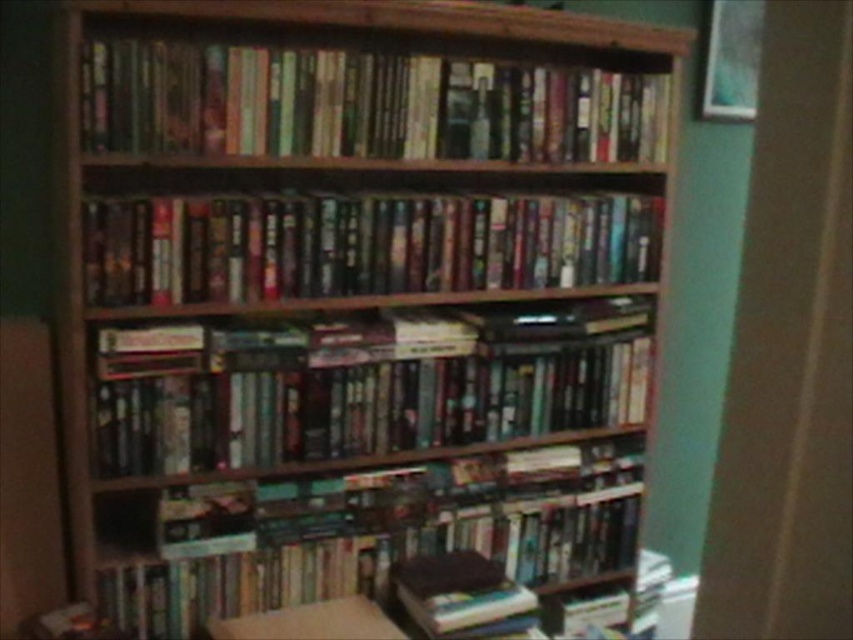
Question: Which object is positioned farthest from the hardcover books at upper center?

Choices:
 (A) hardcover books at center
 (B) shiny plastic books at center

Answer: (A)

Question: Does hardcover books at upper center have a greater width compared to hardcover books at center?

Choices:
 (A) yes
 (B) no

Answer: (A)

Question: Estimate the real-world distances between objects in this image. Which object is closer to the hardcover books at center?

Choices:
 (A) shiny plastic books at center
 (B) hardcover books at upper center

Answer: (A)

Question: Does hardcover books at upper center have a smaller size compared to hardcover books at center?

Choices:
 (A) no
 (B) yes

Answer: (A)

Question: Considering the relative positions of hardcover books at upper center and shiny plastic books at center in the image provided, where is hardcover books at upper center located with respect to shiny plastic books at center?

Choices:
 (A) above
 (B) below

Answer: (A)

Question: Which of the following is the farthest from the observer?

Choices:
 (A) (181, 115)
 (B) (476, 244)
 (C) (538, 344)

Answer: (C)